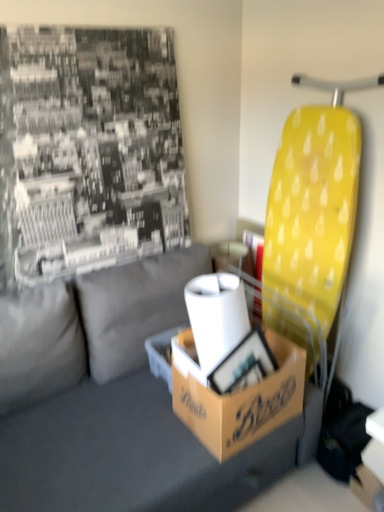
Question: Considering the relative positions of brown cardboard box at center and gray fabric couch at center in the image provided, is brown cardboard box at center to the left or to the right of gray fabric couch at center?

Choices:
 (A) left
 (B) right

Answer: (B)

Question: Is point click(162, 340) positioned closer to the camera than point click(122, 401)?

Choices:
 (A) closer
 (B) farther

Answer: (B)

Question: Which object is positioned closest to the brown cardboard box at center?

Choices:
 (A) white matte toilet paper at center
 (B) gray fabric couch at center
 (C) brown cardboard box at center

Answer: (B)

Question: Which object is the farthest from the white matte toilet paper at center?

Choices:
 (A) brown cardboard box at center
 (B) brown cardboard box at center
 (C) gray fabric couch at center

Answer: (C)